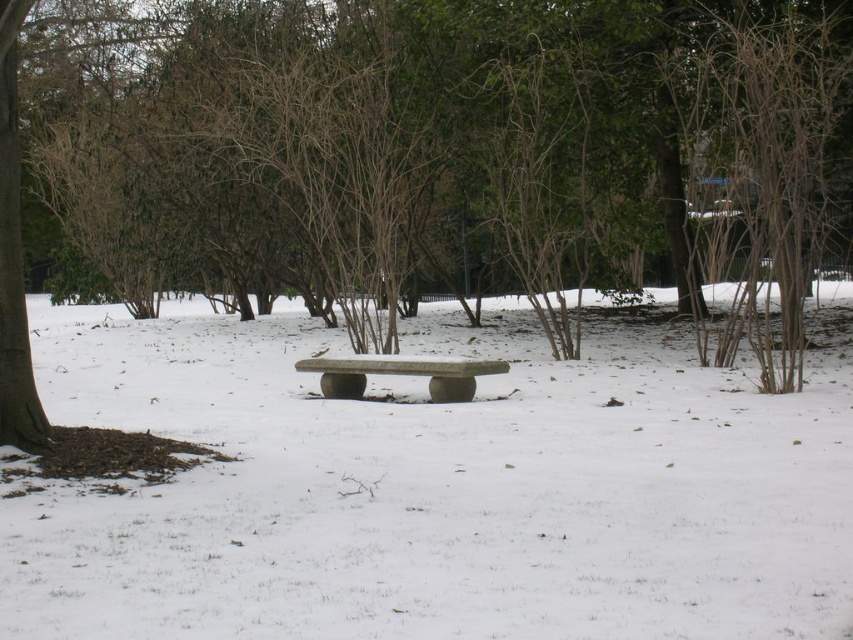
Question: Which point is closer to the camera taking this photo?

Choices:
 (A) (627, 541)
 (B) (305, 362)
 (C) (10, 125)

Answer: (A)

Question: Is green leafy tree at center to the right of gray stone bench at center from the viewer's perspective?

Choices:
 (A) yes
 (B) no

Answer: (A)

Question: Is white matte bench at center to the left of green leafy tree at center from the viewer's perspective?

Choices:
 (A) no
 (B) yes

Answer: (A)

Question: Among these objects, which one is nearest to the camera?

Choices:
 (A) green leafy tree at center
 (B) gray stone bench at center

Answer: (A)

Question: Which point is farther to the camera?

Choices:
 (A) (560, 90)
 (B) (590, 492)

Answer: (A)

Question: Is green leafy tree at center smaller than gray stone bench at center?

Choices:
 (A) no
 (B) yes

Answer: (A)